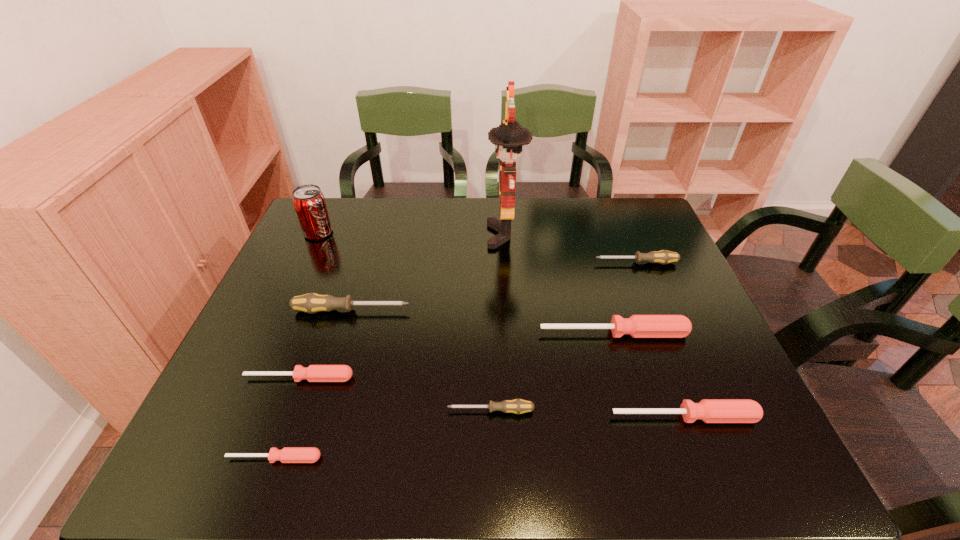
This screenshot has width=960, height=540. Identify the location of vacant space located 0.090m on the back of the nearest red screwdriver. pos(292,410).

I want to click on nutcracker that is at the far edge, so click(x=509, y=137).

What are the coordinates of `pop soda that is at the far edge` in the screenshot? It's located at (308, 200).

You are a GUI agent. You are given a task and a screenshot of the screen. Output one action in this format:
    pyautogui.click(x=<x>, y=<y>)
    Task: Click on the object that is at the near edge
    
    Given the screenshot: What is the action you would take?
    pyautogui.click(x=288, y=454)

At what (x,y) coordinates should I click in order to perform the action: click on pop soda at the left edge. Please return your answer as a coordinate pair (x, y). The image size is (960, 540). Looking at the image, I should click on (308, 200).

Image resolution: width=960 pixels, height=540 pixels. I want to click on object that is at the far left corner, so click(x=308, y=200).

Locate an element on the screen. The width and height of the screenshot is (960, 540). object at the near left corner is located at coordinates (288, 454).

I want to click on vacant area at the far edge of the desktop, so click(x=381, y=223).

Locate an element on the screen. The width and height of the screenshot is (960, 540). free space at the near edge of the desktop is located at coordinates (560, 449).

Identify the location of vacant position at the left edge of the desktop. The width and height of the screenshot is (960, 540). (305, 331).